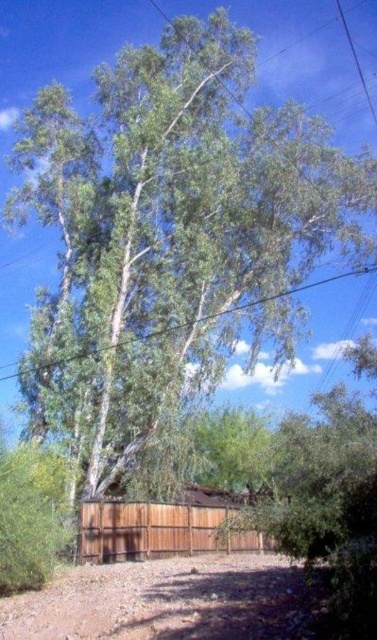
Question: Does brown gravel dirt track at lower center lie behind green leafy tree at upper center?

Choices:
 (A) yes
 (B) no

Answer: (B)

Question: Estimate the real-world distances between objects in this image. Which object is farther from the green leafy tree at upper center?

Choices:
 (A) brown wood fence at center
 (B) brown gravel dirt track at lower center

Answer: (B)

Question: Is brown gravel dirt track at lower center thinner than brown wood fence at center?

Choices:
 (A) yes
 (B) no

Answer: (A)

Question: Does brown wood fence at center appear on the right side of green leafy tree at upper center?

Choices:
 (A) yes
 (B) no

Answer: (B)

Question: Which point is closer to the camera?

Choices:
 (A) green leafy tree at upper center
 (B) brown gravel dirt track at lower center
 (C) brown wood fence at center

Answer: (B)

Question: Which point appears closest to the camera in this image?

Choices:
 (A) (343, 273)
 (B) (170, 560)
 (C) (200, 536)

Answer: (B)